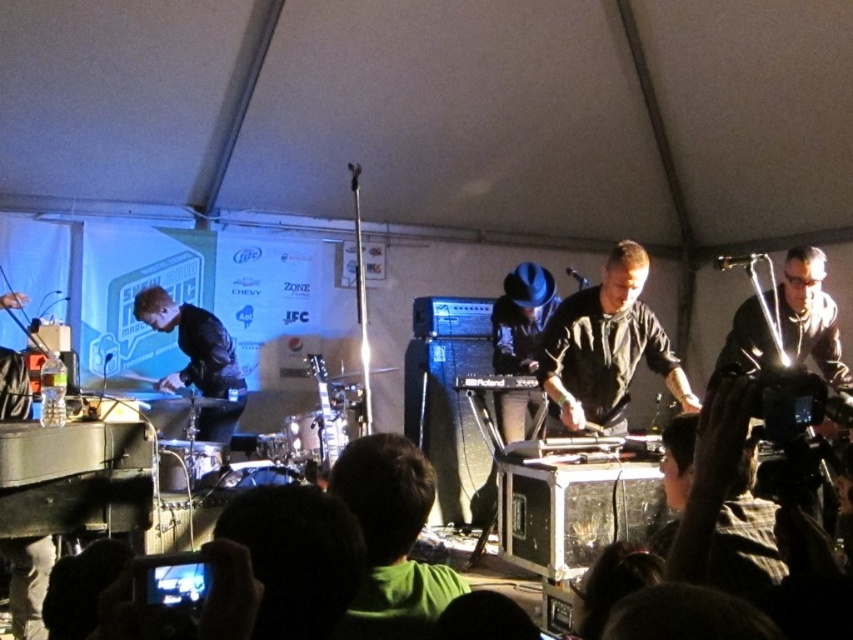
Does black leather jacket at left have a lesser height compared to metallic guitar at center?

In fact, black leather jacket at left may be taller than metallic guitar at center.

From the picture: Does black leather jacket at left appear on the left side of metallic guitar at center?

Correct, you'll find black leather jacket at left to the left of metallic guitar at center.

Between point (167, 385) and point (341, 440), which one is positioned in front?

Point (341, 440)

Where is `black leather jacket at left`? black leather jacket at left is located at coordinates (196, 358).

Between point (206, 323) and point (537, 388), which one is positioned behind?

Positioned behind is point (206, 323).

Does black leather jacket at left have a smaller size compared to black plastic roland keyboard at center?

No.

Who is more forward, (187,339) or (497,376)?

Point (497,376)

At what (x,y) coordinates should I click in order to perform the action: click on black leather jacket at left. Please return your answer as a coordinate pair (x, y). Looking at the image, I should click on (196, 358).

Does metallic guitar at center have a greater width compared to black plastic roland keyboard at center?

No.

Can you confirm if metallic guitar at center is positioned below black plastic roland keyboard at center?

Indeed, metallic guitar at center is positioned under black plastic roland keyboard at center.

Is point (321, 392) positioned before point (479, 390)?

That is False.

At what (x,y) coordinates should I click in order to perform the action: click on metallic guitar at center. Please return your answer as a coordinate pair (x, y). The height and width of the screenshot is (640, 853). Looking at the image, I should click on (326, 416).